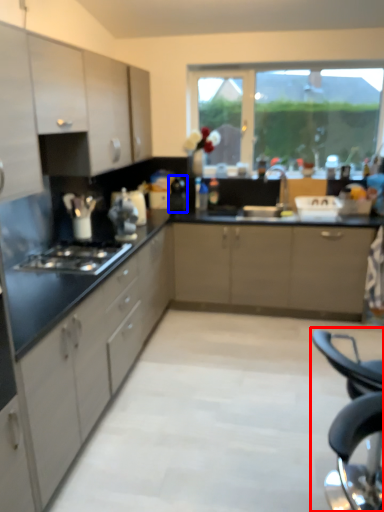
Question: Which of the following is the farthest to the observer, folding chair (highlighted by a red box) or appliance (highlighted by a blue box)?

Choices:
 (A) folding chair
 (B) appliance

Answer: (B)